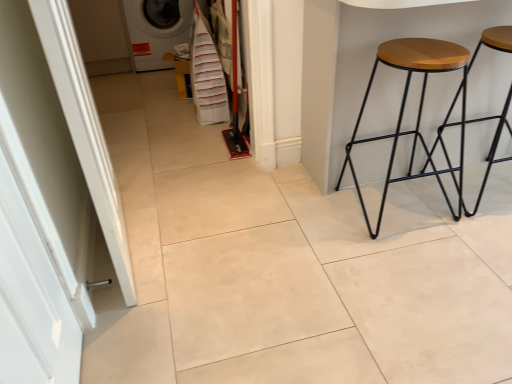
Where is `vacant area that lies to the right of white glossy door at left`? The height and width of the screenshot is (384, 512). vacant area that lies to the right of white glossy door at left is located at coordinates (198, 352).